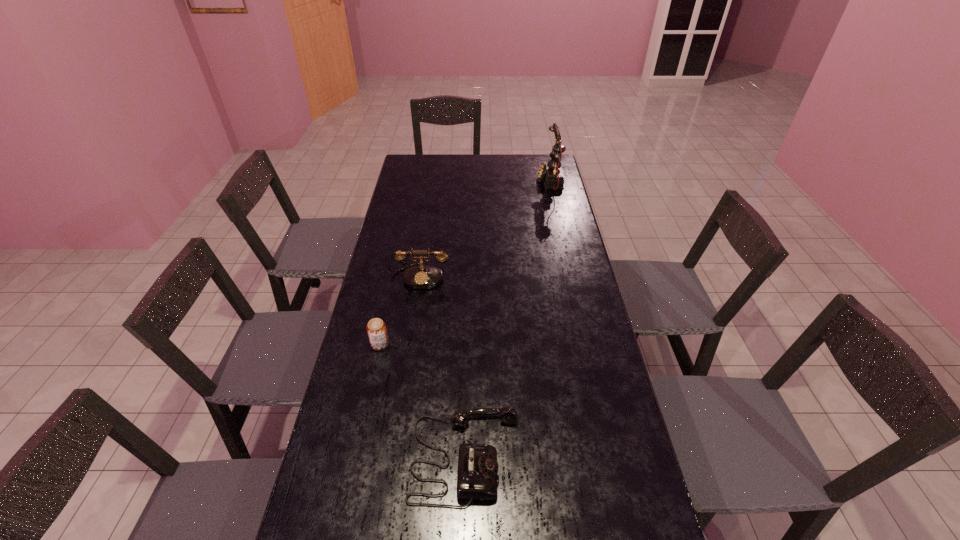
Where is `the rightmost object`? The image size is (960, 540). the rightmost object is located at coordinates (550, 171).

Where is `the tallest object`? The height and width of the screenshot is (540, 960). the tallest object is located at coordinates pos(550,171).

The image size is (960, 540). Identify the location of the second nearest telephone. (423, 276).

This screenshot has height=540, width=960. I want to click on the second tallest object, so click(423, 276).

Find the location of a particular element. The height and width of the screenshot is (540, 960). the nearest object is located at coordinates (477, 472).

The height and width of the screenshot is (540, 960). In order to click on the nearest telephone in this screenshot , I will do `click(477, 472)`.

Where is `the third farthest object`? The width and height of the screenshot is (960, 540). the third farthest object is located at coordinates (376, 328).

Locate an element on the screen. The image size is (960, 540). vacant space located on the dial of the farthest object is located at coordinates (503, 181).

Find the location of a particular element. The image size is (960, 540). vacant space located on the dial of the farthest object is located at coordinates (458, 181).

Find the location of `free space located on the dial of the farthest object`. free space located on the dial of the farthest object is located at coordinates [x=451, y=181].